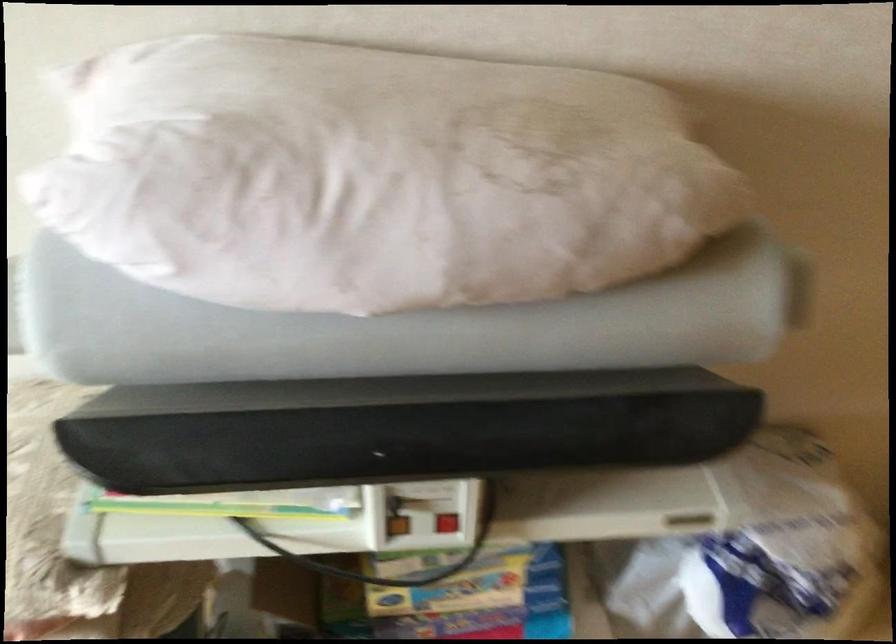
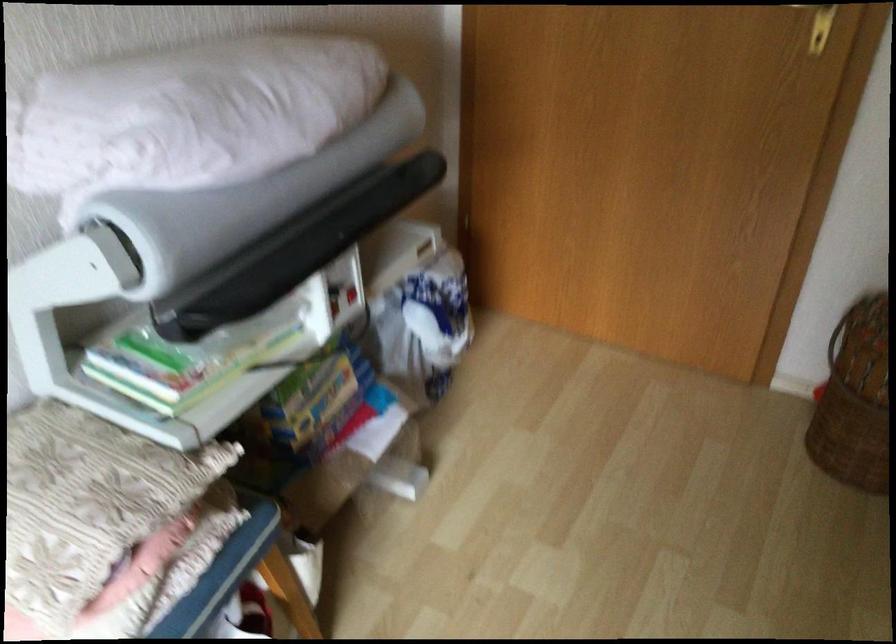
The point at (436,565) is marked in the first image. Where is the corresponding point in the second image?

(315, 397)